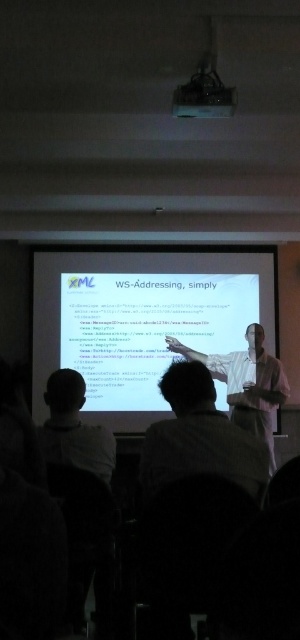
Who is lower down, light brown hair at center or light brown hair at lower left?

light brown hair at lower left is below.

Who is higher up, light brown hair at center or light brown hair at lower left?

light brown hair at center is above.

Is point (225, 467) positioned after point (74, 465)?

No.

Find the location of a particular element. This screenshot has width=300, height=640. light brown hair at center is located at coordinates (198, 436).

Based on the photo, is light brown hair at center to the right of white shirt at center from the viewer's perspective?

In fact, light brown hair at center is to the left of white shirt at center.

Who is higher up, light brown hair at center or white shirt at center?

light brown hair at center

Does point (200, 429) come in front of point (221, 356)?

Yes, point (200, 429) is in front of point (221, 356).

Locate an element on the screen. light brown hair at center is located at coordinates (198, 436).

Can you confirm if light brown hair at center is positioned to the right of matte black projector at upper center?

In fact, light brown hair at center is to the left of matte black projector at upper center.

Which is more to the left, light brown hair at center or matte black projector at upper center?

From the viewer's perspective, light brown hair at center appears more on the left side.

Where is `light brown hair at center`? The image size is (300, 640). light brown hair at center is located at coordinates click(x=198, y=436).

Locate an element on the screen. The image size is (300, 640). light brown hair at center is located at coordinates (198, 436).